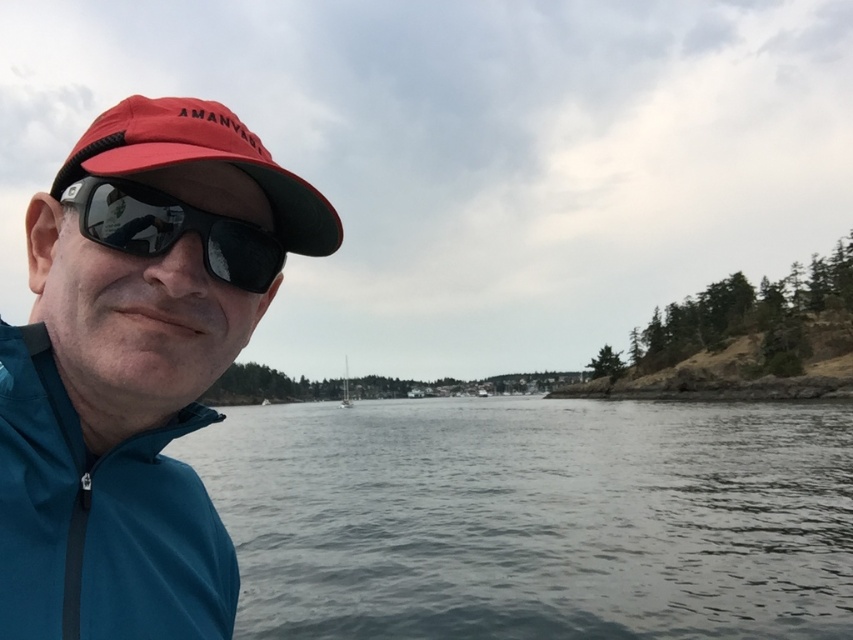
Question: Which point appears closest to the camera in this image?

Choices:
 (A) (146, 232)
 (B) (138, 547)
 (C) (67, 248)
 (D) (447, 609)

Answer: (A)

Question: Can you confirm if matte blue jacket at left is thinner than black matte sunglasses at left?

Choices:
 (A) no
 (B) yes

Answer: (A)

Question: Which object appears closest to the camera in this image?

Choices:
 (A) gray water at center
 (B) white glossy sailboat at center

Answer: (A)

Question: Is teal smooth jacket at lower left wider than white glossy sailboat at center?

Choices:
 (A) no
 (B) yes

Answer: (A)

Question: Considering the real-world distances, which object is farthest from the gray water at center?

Choices:
 (A) red fabric baseball cap at left
 (B) matte blue jacket at left
 (C) teal smooth jacket at lower left
 (D) white glossy sailboat at center

Answer: (D)

Question: Can you confirm if matte blue jacket at left is bigger than teal smooth jacket at lower left?

Choices:
 (A) no
 (B) yes

Answer: (B)